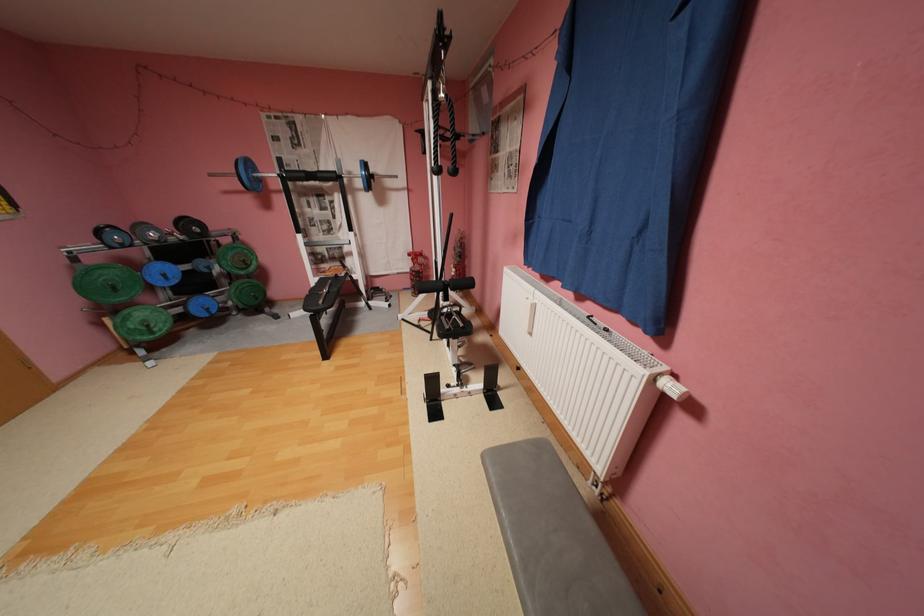
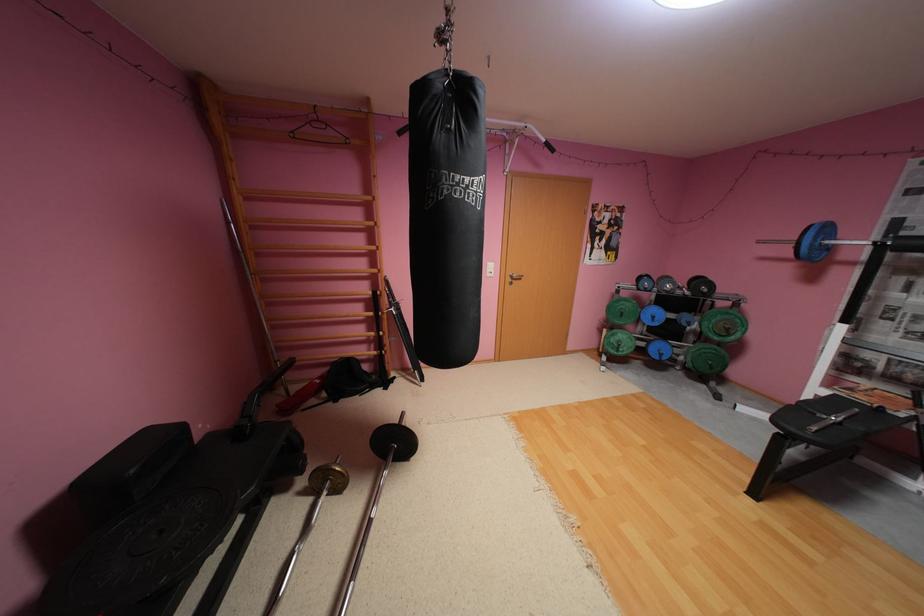
Find the pixel in the second image that matches point 257,265 in the first image.

(737, 334)